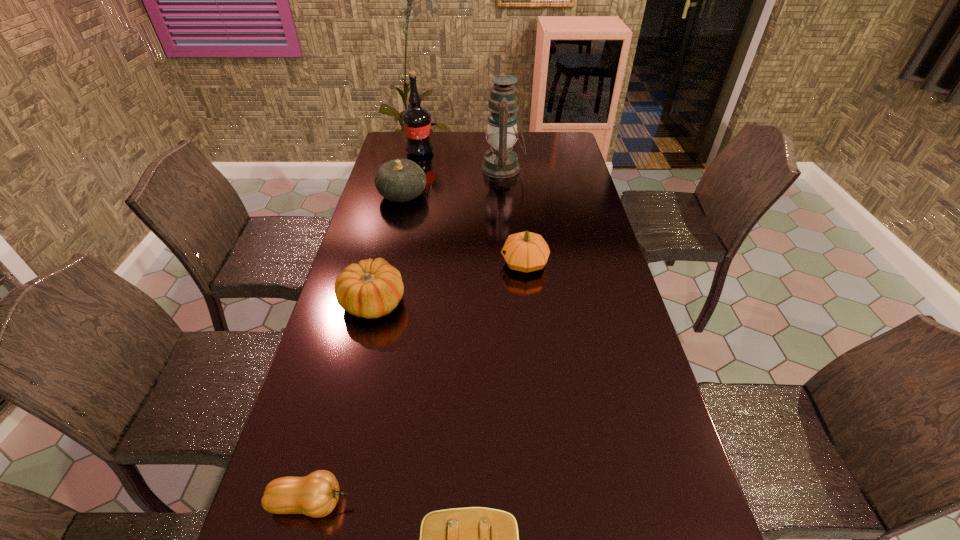
Image resolution: width=960 pixels, height=540 pixels. Find the location of `oil lamp`. oil lamp is located at coordinates (500, 162).

You are a GUI agent. You are given a task and a screenshot of the screen. Output one action in this format:
    pyautogui.click(x=<x>, y=<y>)
    Task: Click on the wine bottle
    The image size is (960, 540).
    Given the screenshot: What is the action you would take?
    pyautogui.click(x=417, y=121)

The image size is (960, 540). In order to click on the tallest gourd in this screenshot , I will do `click(400, 180)`.

You are a GUI agent. You are given a task and a screenshot of the screen. Output one action in this format:
    pyautogui.click(x=<x>, y=<y>)
    Task: Click on the farthest gourd
    
    Given the screenshot: What is the action you would take?
    pyautogui.click(x=400, y=180)

Find the location of a particular element. The image size is (960, 540). the rightmost gourd is located at coordinates (525, 251).

Locate an element on the screen. This screenshot has height=540, width=960. the fourth nearest object is located at coordinates (525, 251).

You are a GUI agent. You are given a task and a screenshot of the screen. Output one action in this format:
    pyautogui.click(x=<x>, y=<y>)
    Task: Click on the third nearest object
    The image size is (960, 540).
    Given the screenshot: What is the action you would take?
    pyautogui.click(x=370, y=289)

At what (x,y) coordinates should I click in order to perform the action: click on the nearest gourd. Please return your answer as a coordinate pair (x, y). This screenshot has width=960, height=540. Looking at the image, I should click on tap(316, 495).

Image resolution: width=960 pixels, height=540 pixels. I want to click on blank space located on the front of the oil lamp, so click(507, 220).

I want to click on vacant space situated on the right of the wine bottle, so click(519, 152).